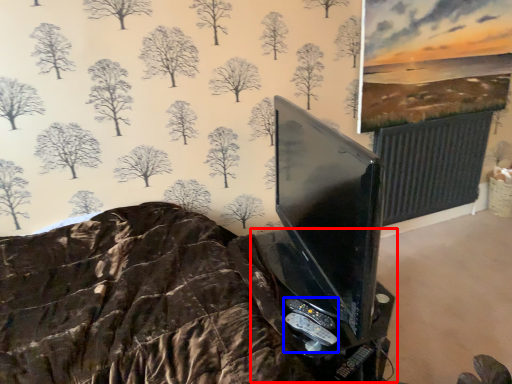
Question: Among these objects, which one is farthest to the camera, table (highlighted by a red box) or game controller (highlighted by a blue box)?

Choices:
 (A) table
 (B) game controller

Answer: (B)